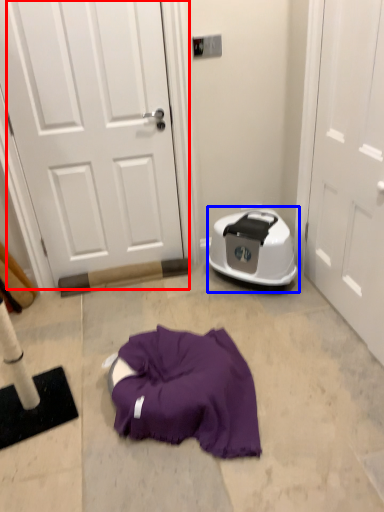
Question: Which object appears closest to the camera in this image, door (highlighted by a red box) or dish washer (highlighted by a blue box)?

Choices:
 (A) door
 (B) dish washer

Answer: (A)